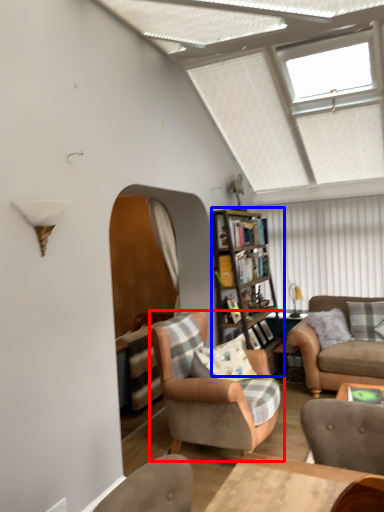
Question: Among these objects, which one is farthest to the camera, chair (highlighted by a red box) or bookcase (highlighted by a blue box)?

Choices:
 (A) chair
 (B) bookcase

Answer: (B)